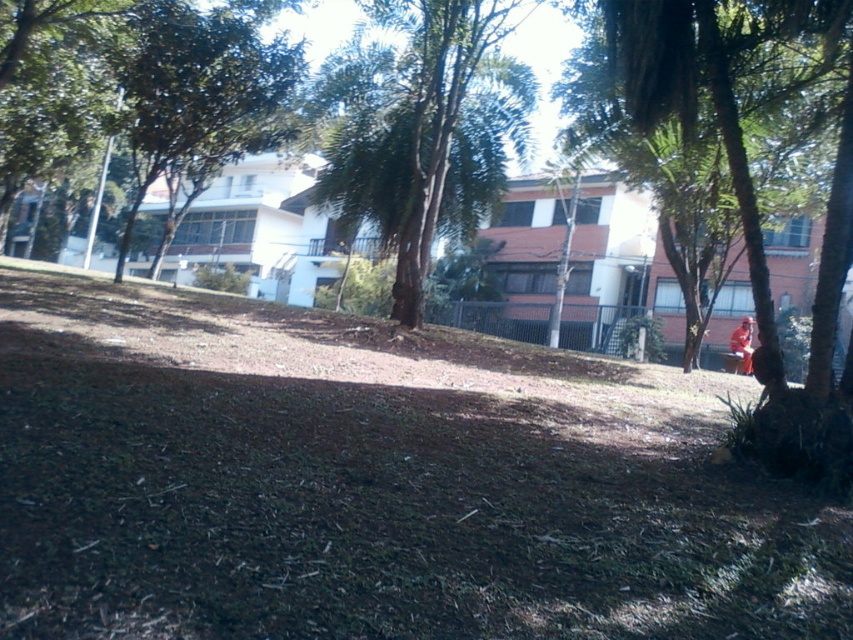
Question: Is green leafy tree at center in front of green leafy tree at upper left?

Choices:
 (A) no
 (B) yes

Answer: (B)

Question: Does green leafy tree at center have a lesser width compared to orange fabric person at lower right?

Choices:
 (A) yes
 (B) no

Answer: (B)

Question: Which object is the closest to the green leafy tree at upper left?

Choices:
 (A) green leafy tree at center
 (B) orange fabric person at lower right

Answer: (A)

Question: Is the position of green leafy tree at center less distant than that of orange fabric person at lower right?

Choices:
 (A) yes
 (B) no

Answer: (A)

Question: Which object is the farthest from the green leafy tree at upper left?

Choices:
 (A) green leafy tree at center
 (B) orange fabric person at lower right

Answer: (B)

Question: Among these points, which one is farthest from the camera?

Choices:
 (A) (280, 88)
 (B) (750, 326)

Answer: (B)